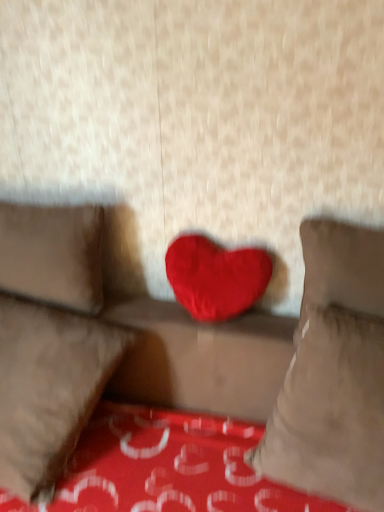
Question: In terms of height, does velvet red heart at center, marked as the first pillow in a right-to-left arrangement, look taller or shorter compared to red plush heart at center?

Choices:
 (A) tall
 (B) short

Answer: (A)

Question: Considering their positions, is velvet red heart at center, marked as the first pillow in a right-to-left arrangement, located in front of or behind red plush heart at center?

Choices:
 (A) front
 (B) behind

Answer: (A)

Question: Considering the real-world distances, which object is closest to the velvet red heart at center, positioned as the third pillow in left-to-right order?

Choices:
 (A) suede-like beige pillow at left, placed as the third pillow when sorted from right to left
 (B) velvet red heart at center
 (C) velvet red heart at center, which is the 2th pillow from right to left
 (D) red plush heart at center

Answer: (B)

Question: Estimate the real-world distances between objects in this image. Which object is farther from the velvet red heart at center?

Choices:
 (A) velvet red heart at center, marked as the first pillow in a right-to-left arrangement
 (B) velvet red heart at center, which is the 2th pillow from left to right
 (C) suede-like beige pillow at left, the first pillow in the left-to-right sequence
 (D) red plush heart at center

Answer: (A)